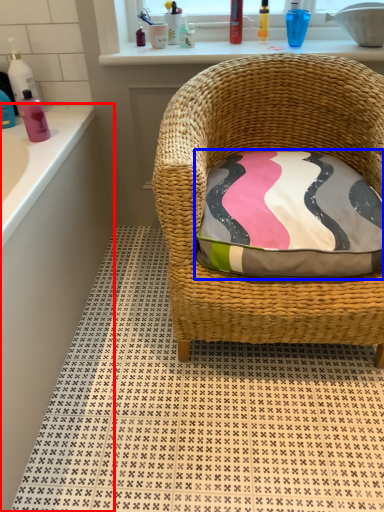
Question: Among these objects, which one is nearest to the camera, bath (highlighted by a red box) or pillow (highlighted by a blue box)?

Choices:
 (A) bath
 (B) pillow

Answer: (A)